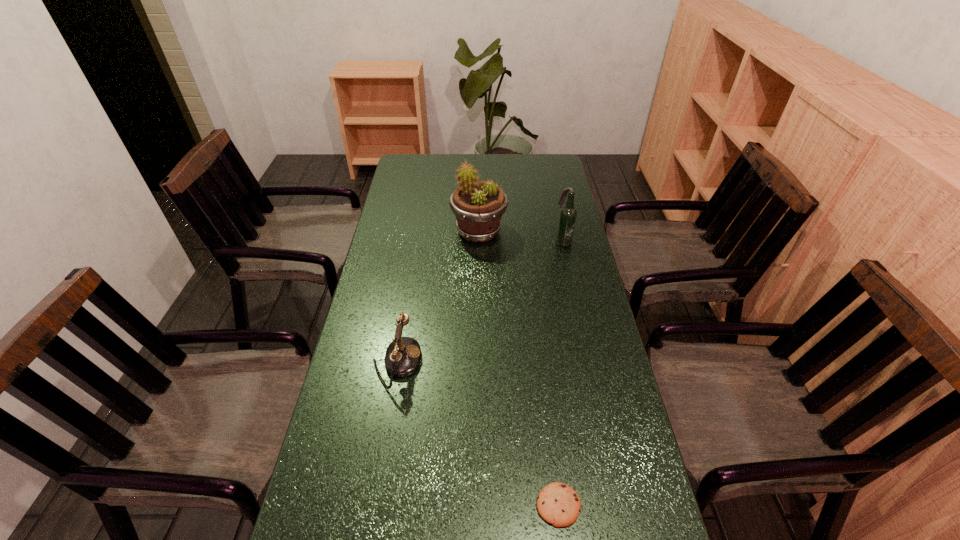
I want to click on free point located on the dial of the leftmost object, so click(x=556, y=363).

The height and width of the screenshot is (540, 960). In order to click on free region located 0.250m on the back of the shortest object in this screenshot , I will do `click(543, 386)`.

Find the location of a particular element. The width and height of the screenshot is (960, 540). object that is at the left edge is located at coordinates (402, 357).

Where is `beer bottle at the right edge`? beer bottle at the right edge is located at coordinates (567, 219).

You are a GUI agent. You are given a task and a screenshot of the screen. Output one action in this format:
    pyautogui.click(x=<x>, y=<y>)
    Task: Click on the cookie present at the right edge
    Image resolution: width=960 pixels, height=540 pixels.
    Given the screenshot: What is the action you would take?
    pyautogui.click(x=558, y=504)

Find the location of a particular element. free space at the far edge of the desktop is located at coordinates (466, 159).

In the image, there is a desktop. Identify the location of free space at the left edge. (376, 371).

I want to click on vacant space at the right edge of the desktop, so click(x=587, y=253).

Locate an element on the screen. This screenshot has height=540, width=960. vacant space at the far left corner of the desktop is located at coordinates [x=409, y=170].

Identify the location of free space at the far right corner. This screenshot has width=960, height=540. (539, 167).